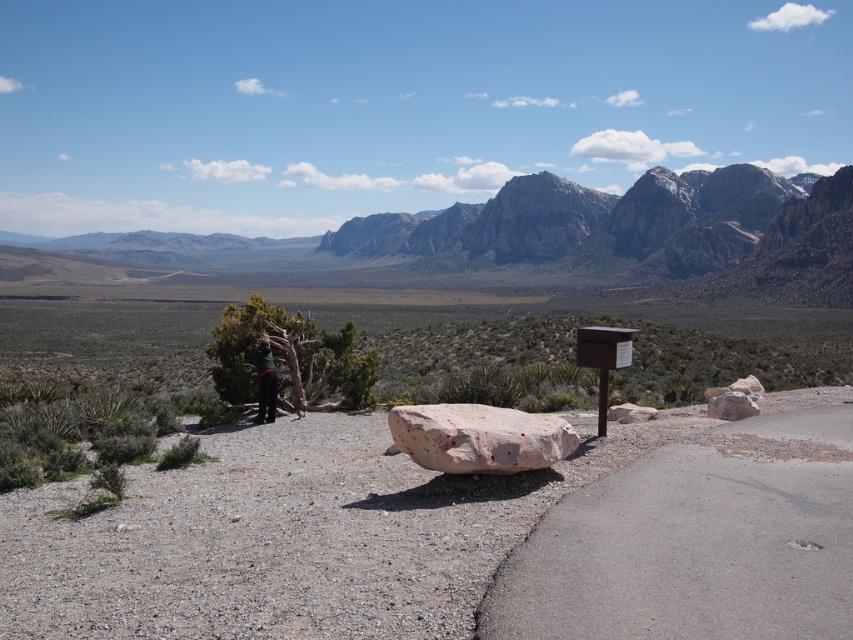
You are a hiker standing on the rusty stone boulder at right. Looking towards the rocky gray mountains at upper center, are they located above or below your current position?

The rocky gray mountains at upper center are located above the rusty stone boulder at right, so they are above your current position.

Based on the coordinates provided, which object in the image corresponds to the point (555,230)?

The rocky gray mountains at upper center correspond to the point (555,230).

You are a hiker who has just found a dark green fabric at center and a rusty stone boulder at right. Which object would you estimate to be larger in size?

The dark green fabric at center is bigger than the rusty stone boulder at right, so the dark green fabric at center is larger in size.